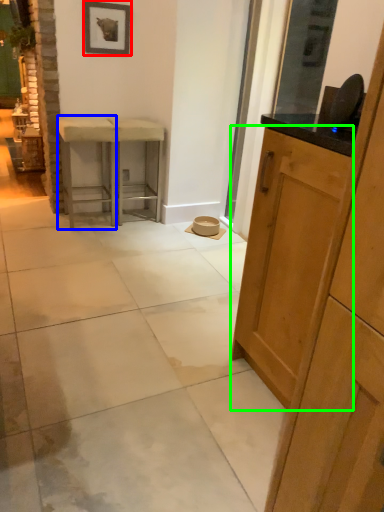
Question: Considering the real-world distances, which object is farthest from picture frame (highlighted by a red box)? stool (highlighted by a blue box) or cabinetry (highlighted by a green box)?

Choices:
 (A) stool
 (B) cabinetry

Answer: (B)